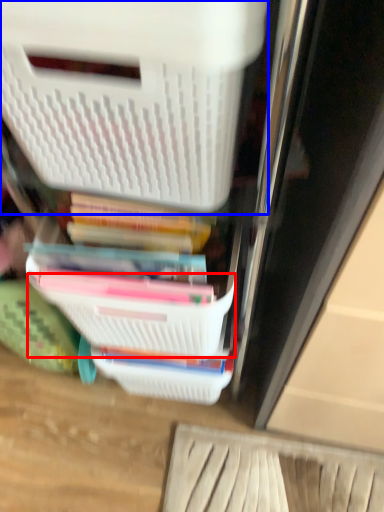
Question: Among these objects, which one is farthest to the camera, basket (highlighted by a red box) or storage box (highlighted by a blue box)?

Choices:
 (A) basket
 (B) storage box

Answer: (A)